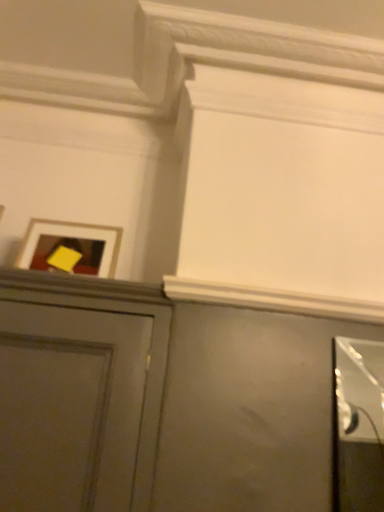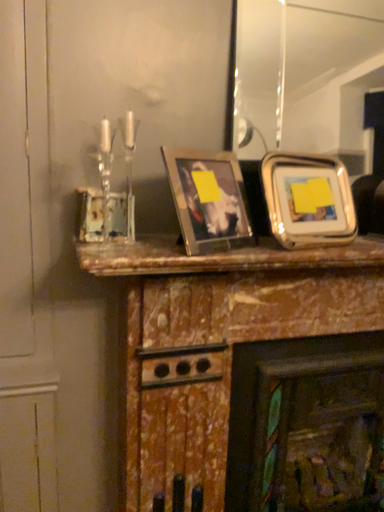
Question: Which way did the camera rotate in the video?

Choices:
 (A) rotated downward
 (B) rotated upward

Answer: (A)